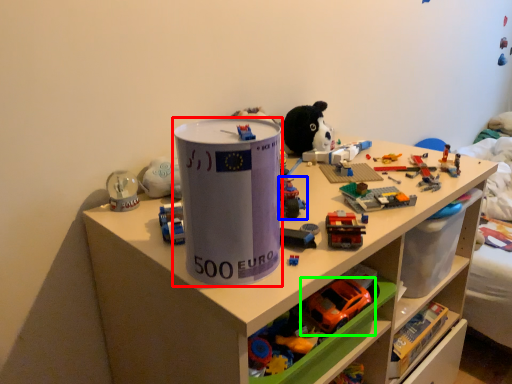
Question: Considering the real-world distances, which object is farthest from paper cup (highlighted by a red box)? toy (highlighted by a blue box) or toy (highlighted by a green box)?

Choices:
 (A) toy
 (B) toy

Answer: (B)